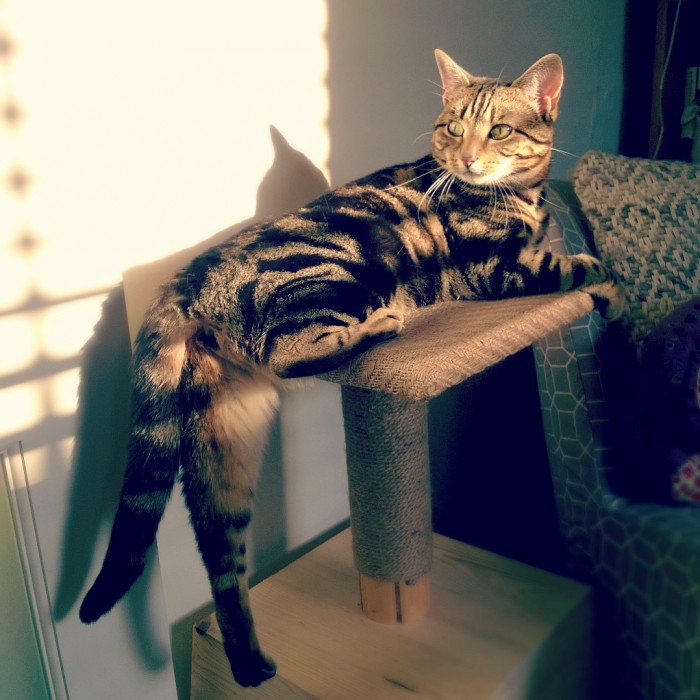
What are the coordinates of `wall` in the screenshot? It's located at (152, 112).